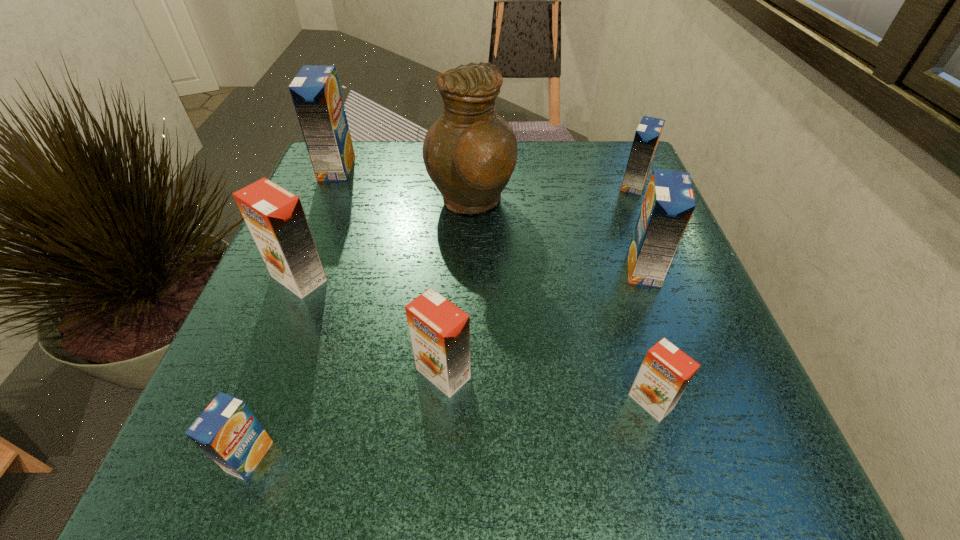
Image resolution: width=960 pixels, height=540 pixels. What are the coordinates of `free spot between the smallest orange orange juice and the biggest orange orange juice` in the screenshot? It's located at (475, 340).

At what (x,y) coordinates should I click in order to perform the action: click on vacant point located between the nearest orange_juice and the farthest orange orange juice. Please return your answer as a coordinate pair (x, y). Looking at the image, I should click on (275, 367).

Where is `object identified as the sixth closest to the second orange orange juice from left to right`? The width and height of the screenshot is (960, 540). object identified as the sixth closest to the second orange orange juice from left to right is located at coordinates (315, 91).

Identify which object is the second closest to the pitcher. Please provide its 2D coordinates. Your answer should be formatted as a tuple, i.e. [(x, y)], where the tuple contains the x and y coordinates of a point satisfying the conditions above.

[(315, 91)]

Locate which orange_juice is the sixth closest to the third farthest blue orange_juice. Please provide its 2D coordinates. Your answer should be formatted as a tuple, i.e. [(x, y)], where the tuple contains the x and y coordinates of a point satisfying the conditions above.

[(315, 91)]

Identify the location of orange_juice that stands as the fourth closest to the biggest orange orange juice. (666, 371).

Identify which blue orange_juice is located as the third nearest to the rightmost orange orange juice. Please provide its 2D coordinates. Your answer should be formatted as a tuple, i.e. [(x, y)], where the tuple contains the x and y coordinates of a point satisfying the conditions above.

[(227, 431)]

This screenshot has height=540, width=960. I want to click on blue orange_juice that is the third closest to the second smallest blue orange_juice, so click(x=227, y=431).

Locate an element on the screen. Image resolution: width=960 pixels, height=540 pixels. orange orange juice that stands as the closest to the third biggest blue orange_juice is located at coordinates (666, 371).

I want to click on orange orange juice that is the second nearest to the second orange orange juice from left to right, so (666, 371).